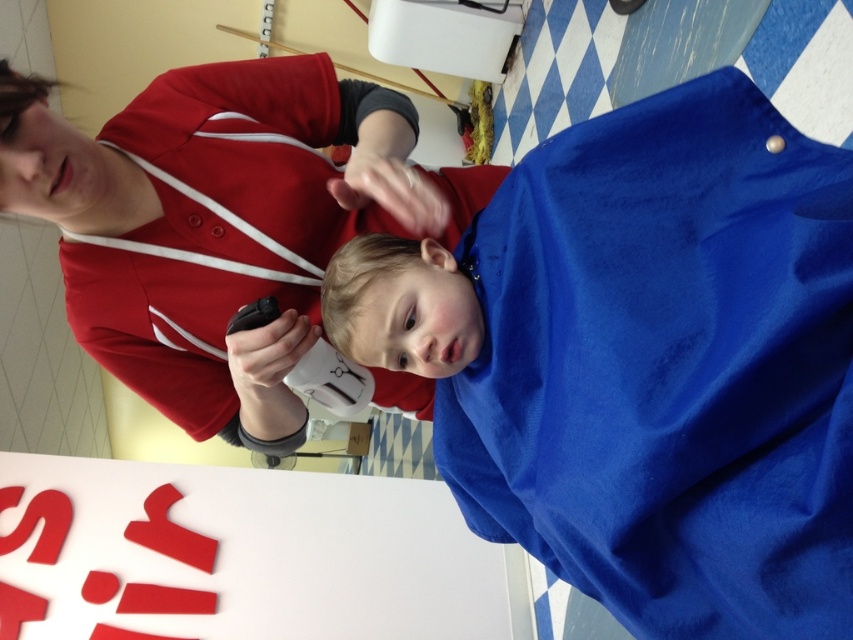
Does blue fabric at center appear under smooth blue towel at center?

Yes, blue fabric at center is below smooth blue towel at center.

Is point (476, 317) farther from viewer compared to point (155, 240)?

No, (476, 317) is in front of (155, 240).

Where is `blue fabric at center`? blue fabric at center is located at coordinates (643, 362).